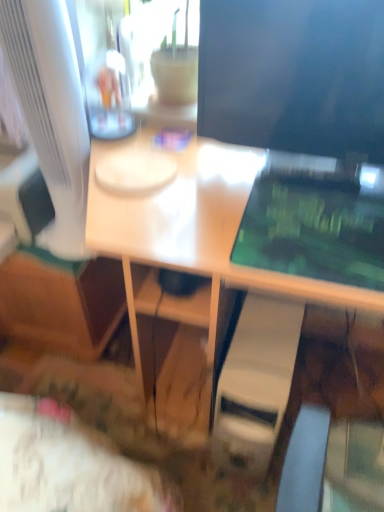
Describe the element at coordinates (51, 112) in the screenshot. I see `white glossy computer monitor at left, positioned as the 1th computer monitor in left-to-right order` at that location.

Describe the element at coordinates (256, 383) in the screenshot. I see `white plastic computer tower at lower center` at that location.

In order to click on white glossy desk at center in this screenshot , I will do `click(242, 220)`.

This screenshot has width=384, height=512. I want to click on matte black monitor at upper right, the second computer monitor when ordered from left to right, so click(x=294, y=76).

Which of these two, white glossy computer monitor at left, positioned as the 1th computer monitor in left-to-right order, or white glossy desk at center, stands taller?

With more height is white glossy desk at center.

Is white glossy computer monitor at left, positioned as the 1th computer monitor in left-to-right order, next to white glossy desk at center?

No, white glossy computer monitor at left, positioned as the 1th computer monitor in left-to-right order, is not beside white glossy desk at center.

Is white glossy computer monitor at left, positioned as the 1th computer monitor in left-to-right order, surrounding white glossy desk at center?

That's incorrect, white glossy desk at center is not inside white glossy computer monitor at left, positioned as the 1th computer monitor in left-to-right order.

Between white glossy computer monitor at left, positioned as the 1th computer monitor in left-to-right order, and white glossy desk at center, which one appears on the right side from the viewer's perspective?

Positioned to the right is white glossy desk at center.

From the image's perspective, which one is positioned lower, matte black monitor at upper right, the second computer monitor when ordered from left to right, or white glossy desk at center?

From the image's view, white glossy desk at center is below.

Is point (336, 145) closer or farther from the camera than point (317, 280)?

Point (336, 145).

Considering the sizes of objects matte black monitor at upper right, which appears as the first computer monitor when viewed from the right, and white glossy desk at center in the image provided, who is smaller, matte black monitor at upper right, which appears as the first computer monitor when viewed from the right, or white glossy desk at center?

Smaller between the two is matte black monitor at upper right, which appears as the first computer monitor when viewed from the right.

Is matte black monitor at upper right, the second computer monitor when ordered from left to right, facing away from white plastic computer tower at lower center?

No, white plastic computer tower at lower center is not at the back of matte black monitor at upper right, the second computer monitor when ordered from left to right.

Between matte black monitor at upper right, the second computer monitor when ordered from left to right, and white plastic computer tower at lower center, which one has smaller width?

Thinner between the two is matte black monitor at upper right, the second computer monitor when ordered from left to right.

Can you tell me how much white plastic computer tower at lower center and white glossy computer monitor at left, the second computer monitor from the right, differ in facing direction?

1.49 degrees separate the facing orientations of white plastic computer tower at lower center and white glossy computer monitor at left, the second computer monitor from the right.

Considering the relative sizes of white plastic computer tower at lower center and white glossy computer monitor at left, positioned as the 1th computer monitor in left-to-right order, in the image provided, is white plastic computer tower at lower center smaller than white glossy computer monitor at left, positioned as the 1th computer monitor in left-to-right order,?

Actually, white plastic computer tower at lower center might be larger than white glossy computer monitor at left, positioned as the 1th computer monitor in left-to-right order.

Could you tell me if white plastic computer tower at lower center is facing white glossy computer monitor at left, the second computer monitor from the right?

No, white plastic computer tower at lower center is not oriented towards white glossy computer monitor at left, the second computer monitor from the right.

Which object is closer to the camera taking this photo, white glossy desk at center or matte black monitor at upper right, the second computer monitor when ordered from left to right?

Positioned in front is white glossy desk at center.

From the picture: Considering the sizes of white glossy desk at center and matte black monitor at upper right, which appears as the first computer monitor when viewed from the right, in the image, is white glossy desk at center taller or shorter than matte black monitor at upper right, which appears as the first computer monitor when viewed from the right,?

Clearly, white glossy desk at center is taller compared to matte black monitor at upper right, which appears as the first computer monitor when viewed from the right.

Is white glossy desk at center to the left of matte black monitor at upper right, which appears as the first computer monitor when viewed from the right, from the viewer's perspective?

Indeed, white glossy desk at center is positioned on the left side of matte black monitor at upper right, which appears as the first computer monitor when viewed from the right.

Does white glossy desk at center have a larger size compared to matte black monitor at upper right, which appears as the first computer monitor when viewed from the right?

Yes.

Between white glossy desk at center and white glossy computer monitor at left, the second computer monitor from the right, which one appears on the left side from the viewer's perspective?

white glossy computer monitor at left, the second computer monitor from the right.

From the image's perspective, relative to white glossy computer monitor at left, positioned as the 1th computer monitor in left-to-right order, is white glossy desk at center above or below?

white glossy desk at center is situated lower than white glossy computer monitor at left, positioned as the 1th computer monitor in left-to-right order, in the image.

Is white glossy desk at center positioned beyond the bounds of white glossy computer monitor at left, positioned as the 1th computer monitor in left-to-right order?

Indeed, white glossy desk at center is completely outside white glossy computer monitor at left, positioned as the 1th computer monitor in left-to-right order.

Locate an element on the screen. desk below the white glossy computer monitor at left, positioned as the 1th computer monitor in left-to-right order (from the image's perspective) is located at coordinates (242, 220).

Between white glossy desk at center and white plastic computer tower at lower center, which one has larger width?

white glossy desk at center.

From a real-world perspective, is white glossy desk at center under white plastic computer tower at lower center?

No, from a real-world perspective, white glossy desk at center is not below white plastic computer tower at lower center.

Consider the image. Is white glossy desk at center positioned with its back to white plastic computer tower at lower center?

Absolutely, white glossy desk at center is directed away from white plastic computer tower at lower center.

Find the location of a particular element. The width and height of the screenshot is (384, 512). desk on the right of white glossy computer monitor at left, positioned as the 1th computer monitor in left-to-right order is located at coordinates (242, 220).

Find the location of a particular element. computer monitor that is the 2nd one when counting upward from the white glossy desk at center (from the image's perspective) is located at coordinates (294, 76).

Looking at the image, which one is located closer to matte black monitor at upper right, which appears as the first computer monitor when viewed from the right, white plastic computer tower at lower center or white glossy computer monitor at left, positioned as the 1th computer monitor in left-to-right order?

Based on the image, white glossy computer monitor at left, positioned as the 1th computer monitor in left-to-right order, appears to be nearer to matte black monitor at upper right, which appears as the first computer monitor when viewed from the right.

Based on their spatial positions, is matte black monitor at upper right, the second computer monitor when ordered from left to right, or white glossy computer monitor at left, the second computer monitor from the right, closer to white plastic computer tower at lower center?

matte black monitor at upper right, the second computer monitor when ordered from left to right, lies closer to white plastic computer tower at lower center than the other object.

From the image, which object appears to be farther from white glossy desk at center, white glossy computer monitor at left, the second computer monitor from the right, or white plastic computer tower at lower center?

The object further to white glossy desk at center is white glossy computer monitor at left, the second computer monitor from the right.

From the image, which object appears to be farther from white glossy computer monitor at left, positioned as the 1th computer monitor in left-to-right order, white glossy desk at center or matte black monitor at upper right, the second computer monitor when ordered from left to right?

Among the two, matte black monitor at upper right, the second computer monitor when ordered from left to right, is located further to white glossy computer monitor at left, positioned as the 1th computer monitor in left-to-right order.

When comparing their distances from matte black monitor at upper right, the second computer monitor when ordered from left to right, does white glossy computer monitor at left, the second computer monitor from the right, or white glossy desk at center seem further?

white glossy computer monitor at left, the second computer monitor from the right, is further to matte black monitor at upper right, the second computer monitor when ordered from left to right.

Based on their spatial positions, is white plastic computer tower at lower center or matte black monitor at upper right, the second computer monitor when ordered from left to right, closer to white glossy desk at center?

matte black monitor at upper right, the second computer monitor when ordered from left to right.

Based on their spatial positions, is white glossy computer monitor at left, positioned as the 1th computer monitor in left-to-right order, or white plastic computer tower at lower center closer to matte black monitor at upper right, the second computer monitor when ordered from left to right?

white glossy computer monitor at left, positioned as the 1th computer monitor in left-to-right order, is closer to matte black monitor at upper right, the second computer monitor when ordered from left to right.

When comparing their distances from white glossy computer monitor at left, positioned as the 1th computer monitor in left-to-right order, does white plastic computer tower at lower center or white glossy desk at center seem further?

The object further to white glossy computer monitor at left, positioned as the 1th computer monitor in left-to-right order, is white plastic computer tower at lower center.

Where is `desk between matte black monitor at upper right, which appears as the first computer monitor when viewed from the right, and white plastic computer tower at lower center vertically`? This screenshot has height=512, width=384. desk between matte black monitor at upper right, which appears as the first computer monitor when viewed from the right, and white plastic computer tower at lower center vertically is located at coordinates (242, 220).

You are a GUI agent. You are given a task and a screenshot of the screen. Output one action in this format:
    pyautogui.click(x=<x>, y=<y>)
    Task: Click on the computer monitor between matte black monitor at upper right, which appears as the first computer monitor when viewed from the right, and white plastic computer tower at lower center vertically
    The image size is (384, 512).
    Given the screenshot: What is the action you would take?
    pyautogui.click(x=51, y=112)

The height and width of the screenshot is (512, 384). I want to click on desk that lies between white glossy computer monitor at left, the second computer monitor from the right, and white plastic computer tower at lower center from top to bottom, so click(x=242, y=220).

The height and width of the screenshot is (512, 384). I want to click on desk between white glossy computer monitor at left, positioned as the 1th computer monitor in left-to-right order, and matte black monitor at upper right, which appears as the first computer monitor when viewed from the right, from left to right, so click(242, 220).